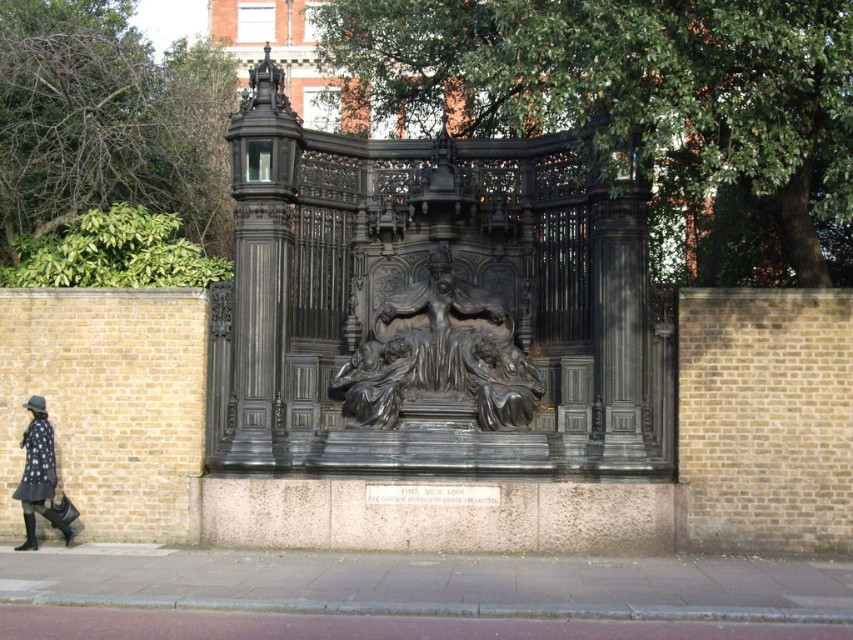
Is point (397, 352) more distant than point (24, 500)?

Yes, it is.

From the picture: Measure the distance between black polished stone sculpture at center and camera.

black polished stone sculpture at center and camera are 39.49 meters apart from each other.

Where is `black polished stone sculpture at center`? black polished stone sculpture at center is located at coordinates (439, 355).